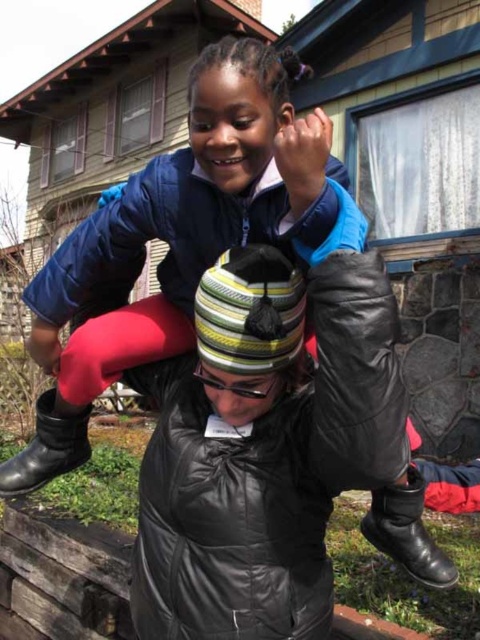
You are standing at the point marked as point (x=424, y=486) and want to throw a ball to your friend who is standing 4.07 feet away from you. What is the minimum distance you need to throw the ball to reach your friend?

The minimum distance you need to throw the ball is 4.07 feet, as they are 4.07 feet apart.

You are a photographer trying to capture the scene where the black leather boot at lower center is visible. Based on its position, which part of the image should you focus on to ensure the boot is in the frame?

The black leather boot at lower center is located at point (407, 532), so you should focus on the lower central area of the image to ensure it is in the frame.

You are a photographer trying to capture a clear shot of the child and adult. You notice two black leather boots in the scene. Which boot is closer to the camera, the black leather boot at lower center or the black leather boot at lower left?

The black leather boot at lower center is positioned under the black leather boot at lower left, so the boot at lower left is closer to the camera.